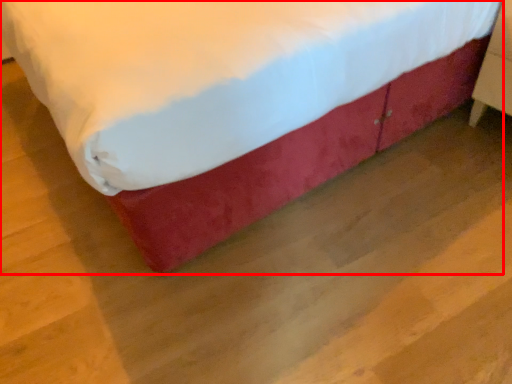
Question: Considering the relative positions of bed (annotated by the red box) and furniture in the image provided, where is bed (annotated by the red box) located with respect to the staircase?

Choices:
 (A) right
 (B) left

Answer: (B)